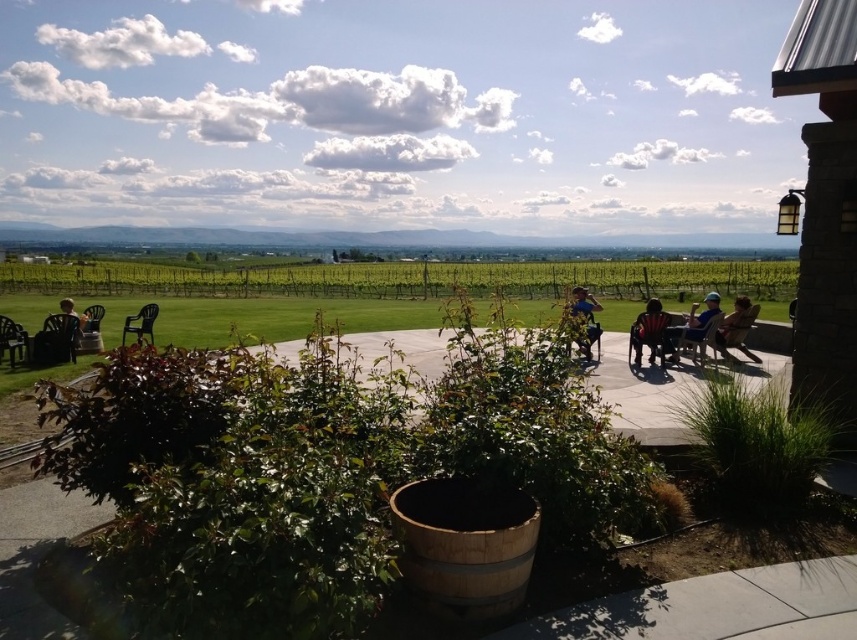
You are a photographer standing at the edge of the garden. You want to take a photo that includes both the green grass at center and the wooden chair at center. Which object should you focus on first to ensure both are in the frame?

You should focus on the green grass at center first since it is closer to you than the wooden chair at center, ensuring both are in the frame.